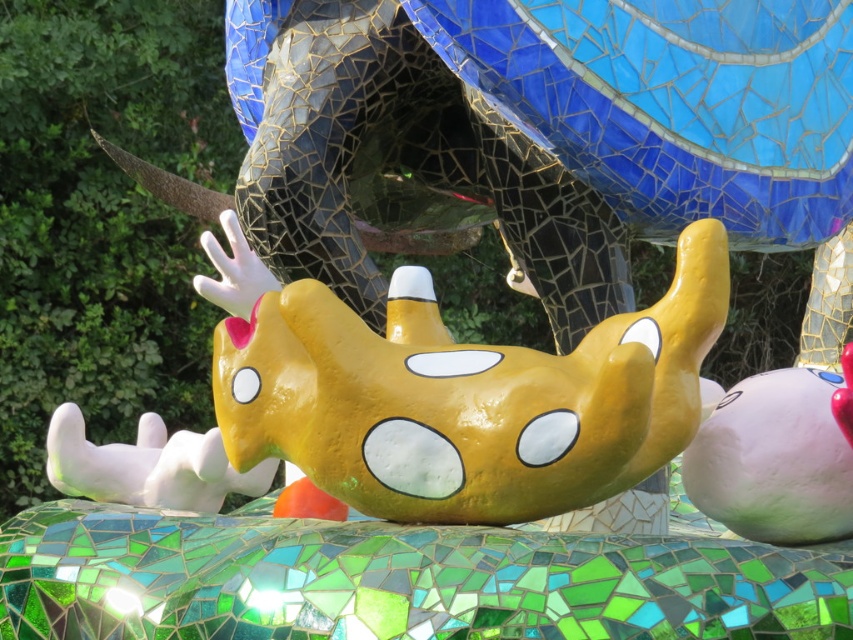
Consider the image. You are standing in front of the colorful mosaic sculpture and want to touch the points labeled as point (781, 477) and point (171, 474). Which point can you reach first without moving your position?

Point (781, 477) is closer to the camera than point (171, 474), so you can reach point (781, 477) first without moving your position.

You are an artist standing at the edge of the scene and want to place a new object exactly at the center of the image. However, there is already a yellow matte toy at center. Where would you place your new object?

The yellow matte toy at center is already located at the center of the image, so placing another object there would overlap with it.

You are standing in front of the mosaic sculpture and see the yellow matte toy at center and the matte white plush at lower right. Which object is positioned higher in the image?

The yellow matte toy at center is located above the matte white plush at lower right, so it is positioned higher in the image.